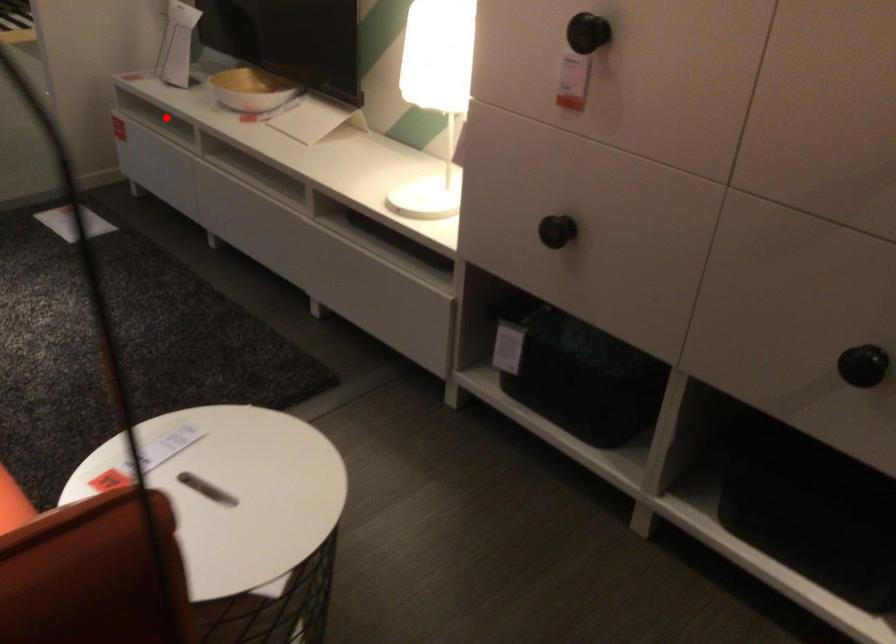
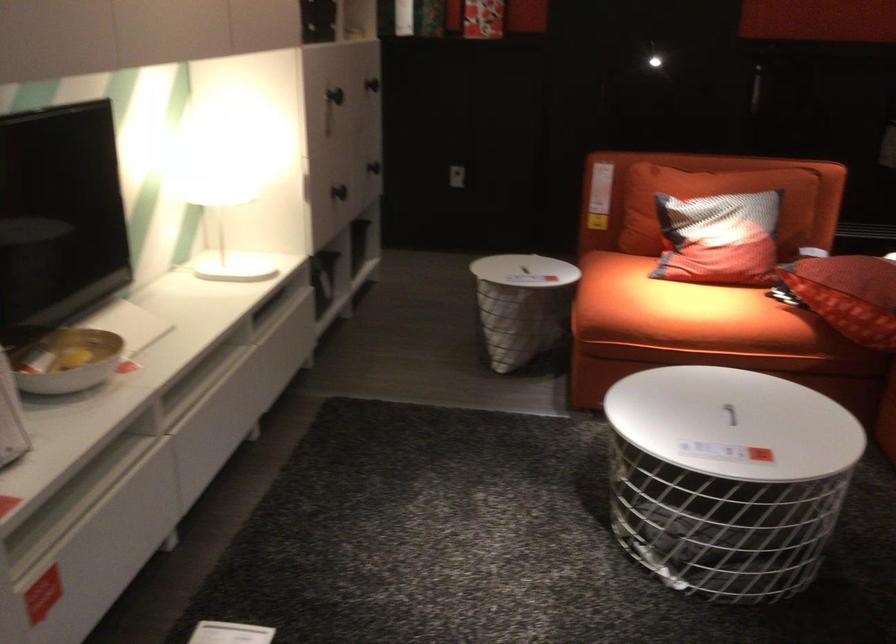
The point at the highlighted location is marked in the first image. Where is the corresponding point in the second image?

(74, 500)